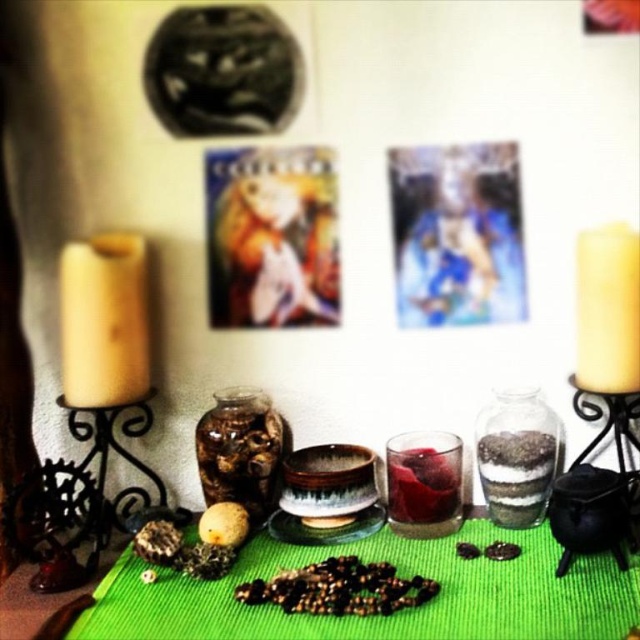
Can you confirm if translucent glass jar at center is wider than transparent glass at center?

Yes, translucent glass jar at center is wider than transparent glass at center.

Does translucent glass jar at center have a greater height compared to transparent glass at center?

Indeed, translucent glass jar at center has a greater height compared to transparent glass at center.

At what (x,y) coordinates should I click in order to perform the action: click on translucent glass jar at center. Please return your answer as a coordinate pair (x, y). Image resolution: width=640 pixels, height=640 pixels. Looking at the image, I should click on (241, 451).

Does point (579, 580) lie in front of point (528, 445)?

Yes, it is in front of point (528, 445).

Does green felt table at center come behind translucent glass jar at center-right?

No, green felt table at center is in front of translucent glass jar at center-right.

Which is behind, point (406, 621) or point (541, 445)?

Positioned behind is point (541, 445).

Find the location of `green felt table at center`. green felt table at center is located at coordinates (378, 616).

Who is higher up, metallic gold frame at center or blue fabric picture frame at upper center?

blue fabric picture frame at upper center is higher up.

Between metallic gold frame at center and blue fabric picture frame at upper center, which one appears on the right side from the viewer's perspective?

From the viewer's perspective, blue fabric picture frame at upper center appears more on the right side.

Which is in front, point (259, 253) or point (504, 316)?

Point (504, 316) is more forward.

The image size is (640, 640). What are the coordinates of `metallic gold frame at center` in the screenshot? It's located at (272, 237).